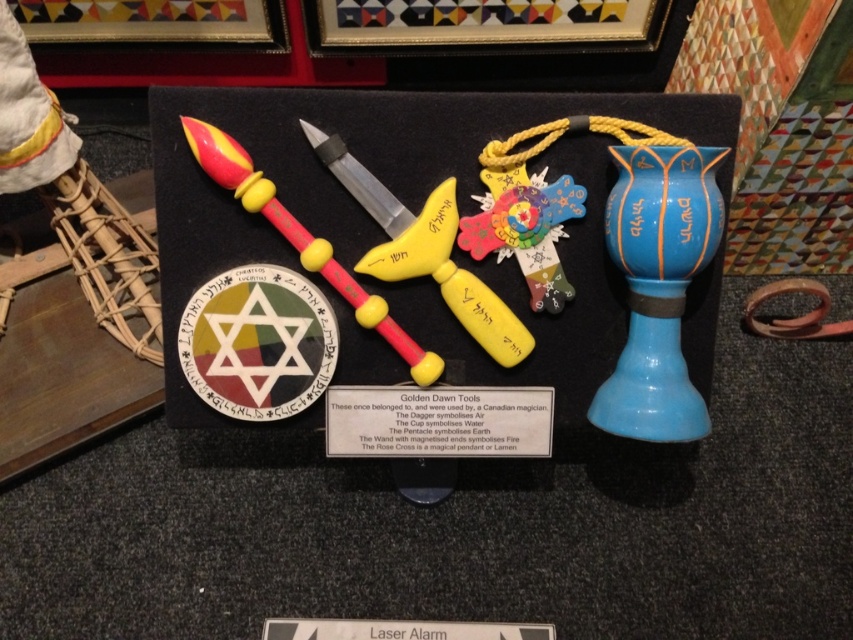
Question: Which object is closer to the camera taking this photo?

Choices:
 (A) wooden cross at center
 (B) yellow matte knife at center
 (C) blue glossy cup at upper right
 (D) matte plastic wand at center

Answer: (C)

Question: Which point is farther to the camera?

Choices:
 (A) wooden circular object at center
 (B) yellow matte knife at center

Answer: (A)

Question: Is the position of blue glossy cup at upper right less distant than that of matte plastic wand at center?

Choices:
 (A) no
 (B) yes

Answer: (B)

Question: Is wooden circular object at center thinner than wooden cross at center?

Choices:
 (A) no
 (B) yes

Answer: (A)

Question: Which object is the closest to the yellow matte knife at center?

Choices:
 (A) wooden circular object at center
 (B) matte plastic wand at center
 (C) wooden cross at center

Answer: (C)

Question: Is blue glossy cup at upper right closer to camera compared to wooden cross at center?

Choices:
 (A) yes
 (B) no

Answer: (A)